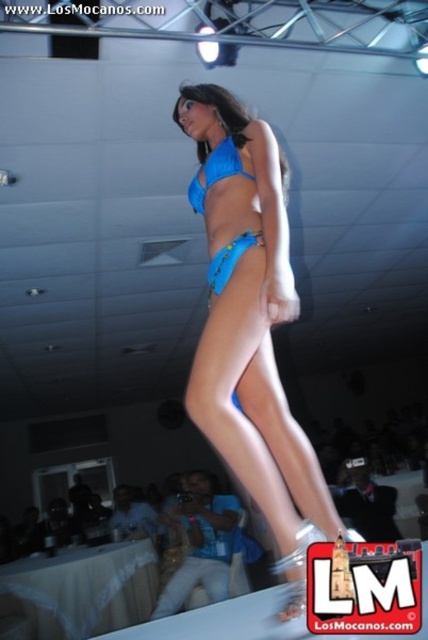
You are a photographer at the runway show and need to capture the model wearing both the blue shiny bikini at center and the blue matte bikini top at center. Which one is located to the right of the other?

The blue shiny bikini at center is positioned on the right side of the blue matte bikini top at center.

You are a fashion designer observing the runway show. You notice the blue matte bikini at center and the blue matte bikini top at center. Which part of the bikini is taller in the image?

The blue matte bikini at center has a greater height compared to the blue matte bikini top at center.